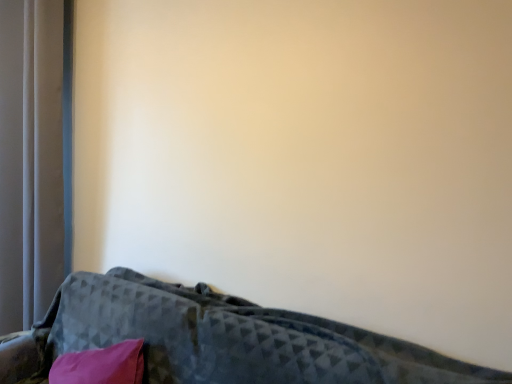
Question: From a real-world perspective, is silky gray curtain at left physically located above or below velvet dark gray couch at lower left?

Choices:
 (A) above
 (B) below

Answer: (A)

Question: Is silky gray curtain at left wider or thinner than velvet dark gray couch at lower left?

Choices:
 (A) thin
 (B) wide

Answer: (A)

Question: From the image's perspective, is silky gray curtain at left positioned above or below velvet dark gray couch at lower left?

Choices:
 (A) below
 (B) above

Answer: (B)

Question: Do you think velvet dark gray couch at lower left is within silky gray curtain at left, or outside of it?

Choices:
 (A) inside
 (B) outside

Answer: (B)

Question: Is velvet dark gray couch at lower left in front of or behind silky gray curtain at left in the image?

Choices:
 (A) behind
 (B) front

Answer: (B)

Question: Would you say velvet dark gray couch at lower left is to the left or to the right of silky gray curtain at left in the picture?

Choices:
 (A) right
 (B) left

Answer: (A)

Question: From the image's perspective, is velvet dark gray couch at lower left above or below silky gray curtain at left?

Choices:
 (A) above
 (B) below

Answer: (B)